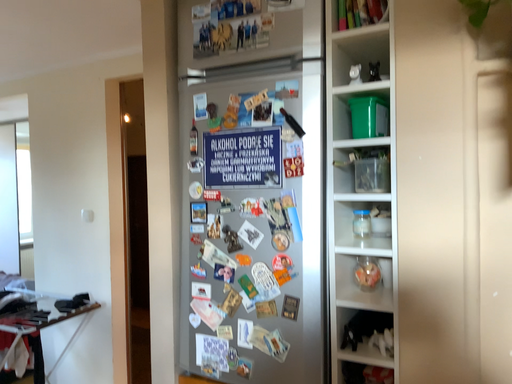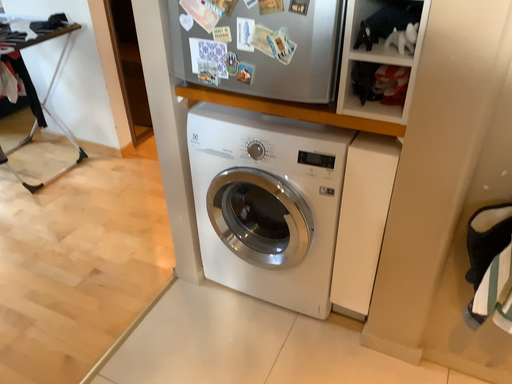
Question: Which way did the camera rotate in the video?

Choices:
 (A) rotated upward
 (B) rotated downward

Answer: (B)